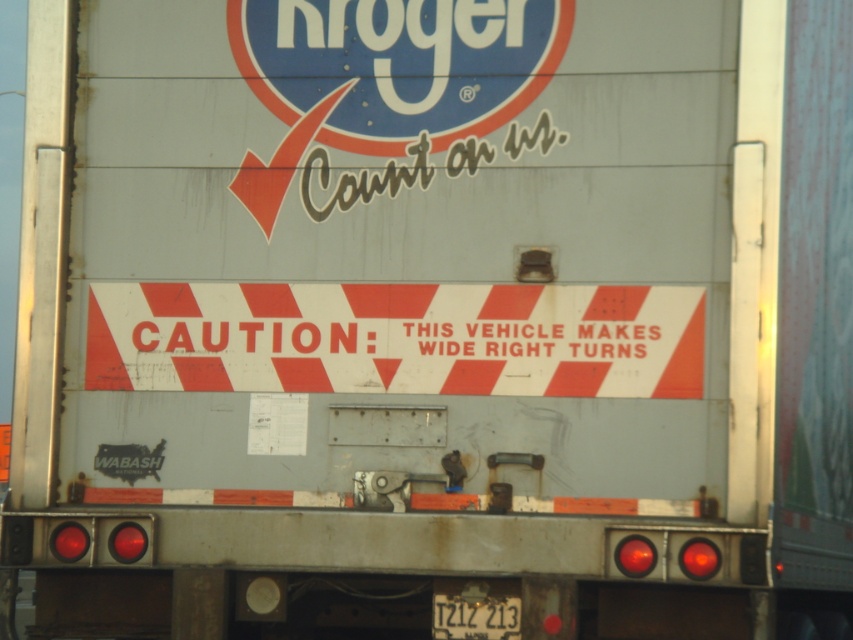
Who is taller, white/red striped sign at center or black plastic license plate at bottom center?

Standing taller between the two is white/red striped sign at center.

Identify the location of white/red striped sign at center. (397, 339).